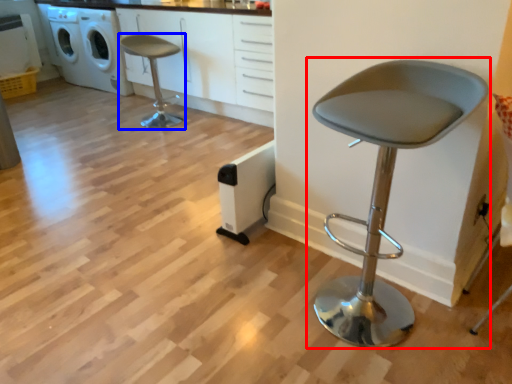
Question: Which point is closer to the camera, chair (highlighted by a red box) or chair (highlighted by a blue box)?

Choices:
 (A) chair
 (B) chair

Answer: (A)